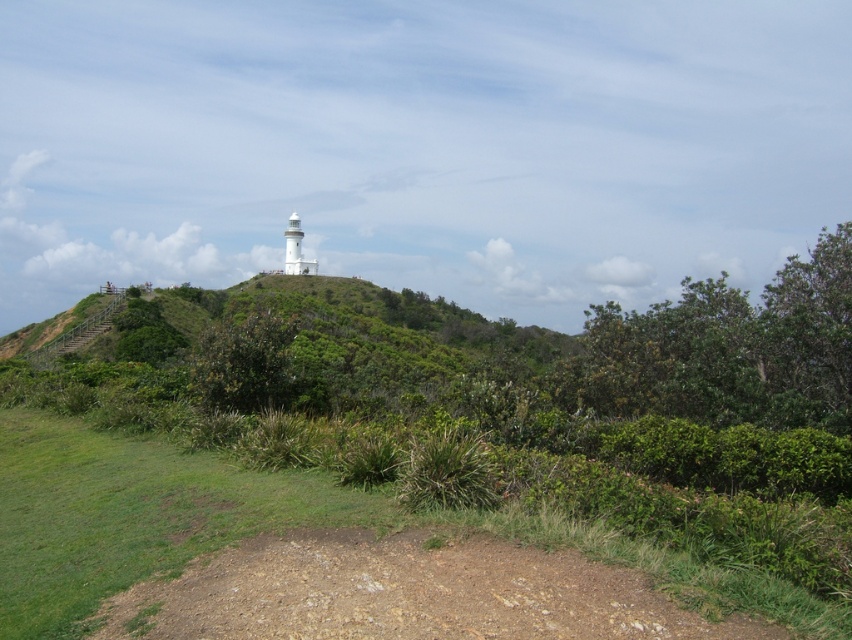
Question: Does green grassy at lower left lie behind green leafy hillside at upper center?

Choices:
 (A) no
 (B) yes

Answer: (A)

Question: Which object is positioned closest to the green grassy at lower left?

Choices:
 (A) green leafy hillside at upper center
 (B) dirt/gravel path at lower center

Answer: (B)

Question: Which object is the farthest from the dirt/gravel path at lower center?

Choices:
 (A) green leafy hillside at upper center
 (B) green grassy at lower left

Answer: (A)

Question: Is green grassy at lower left closer to the viewer compared to green leafy hillside at upper center?

Choices:
 (A) yes
 (B) no

Answer: (A)

Question: Is green grassy at lower left positioned behind green leafy hillside at upper center?

Choices:
 (A) yes
 (B) no

Answer: (B)

Question: Estimate the real-world distances between objects in this image. Which object is closer to the green leafy hillside at upper center?

Choices:
 (A) green grassy at lower left
 (B) dirt/gravel path at lower center

Answer: (A)